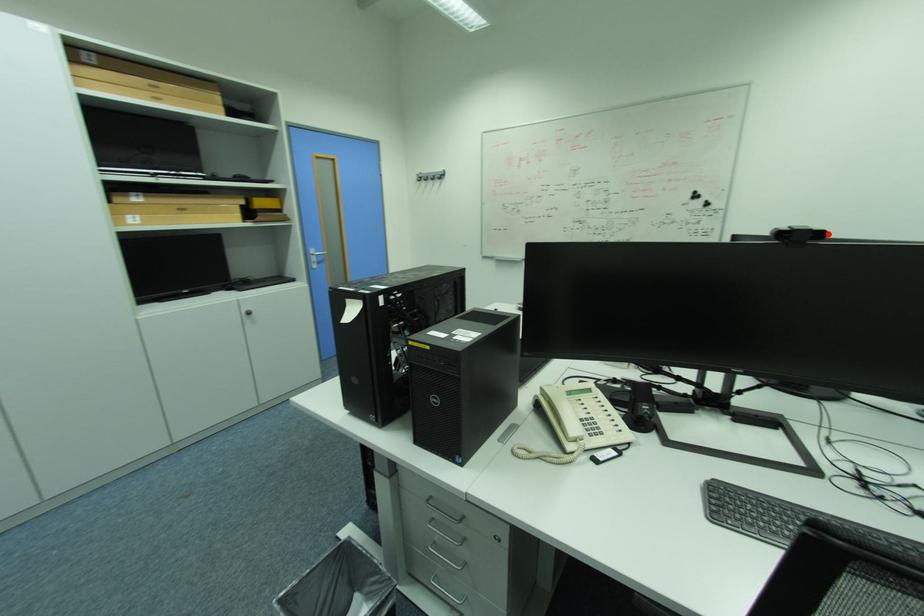
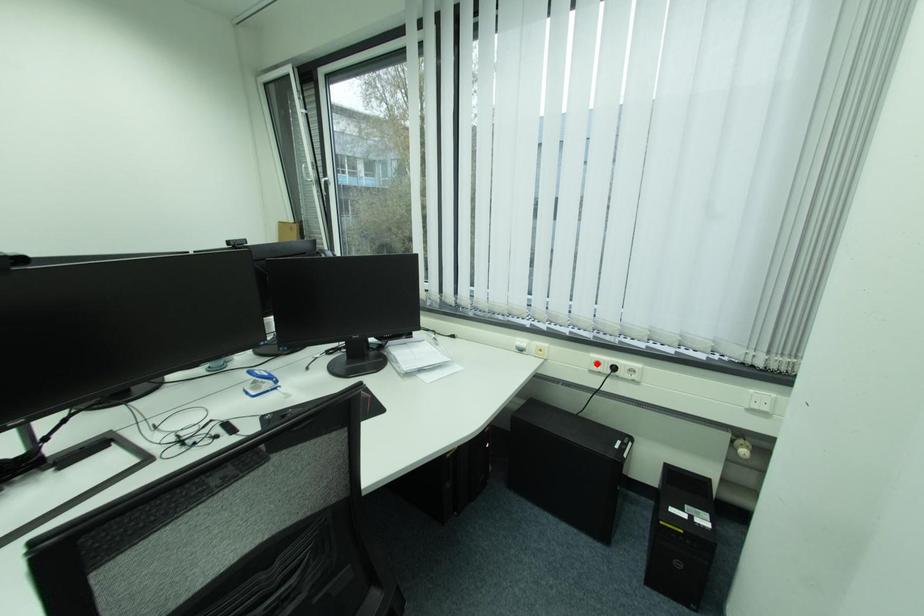
I am providing you with two images of the same scene from different viewpoints. A red point is marked on the first image and another point is marked on the second image. Is the red point in image1 aligned with the point shown in image2?

No